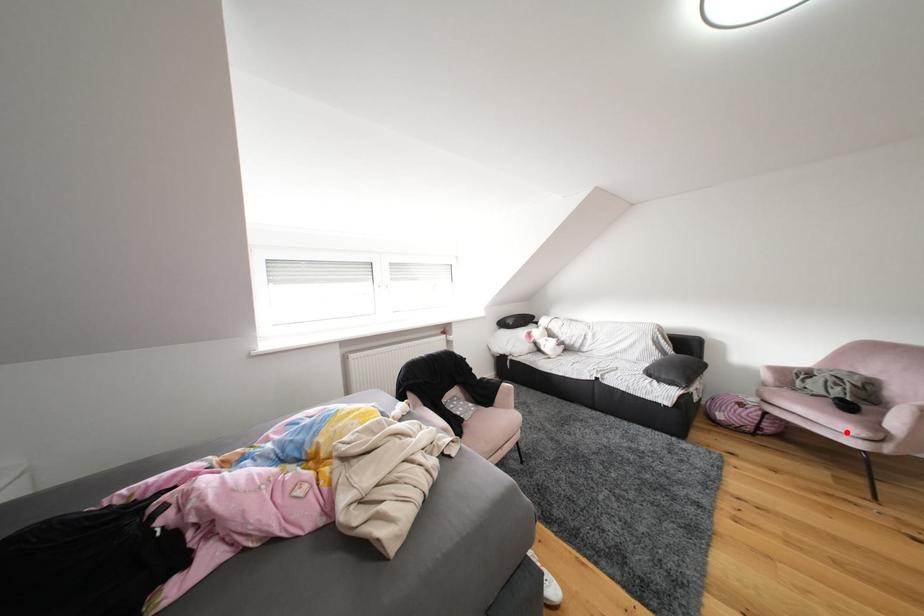
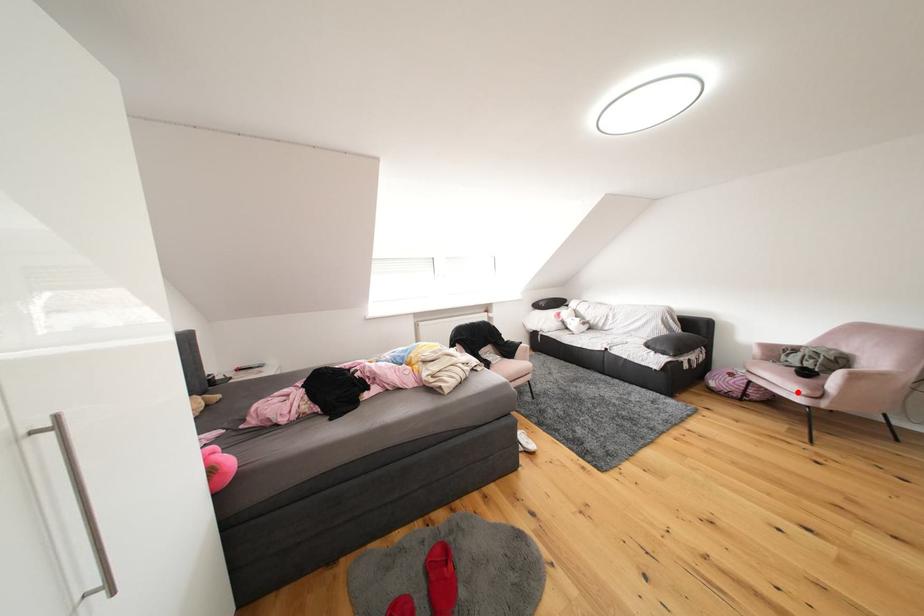
I am providing you with two images of the same scene from different viewpoints. A red point is marked on the first image and another point is marked on the second image. Is the red point in image1 aligned with the point shown in image2?

Yes